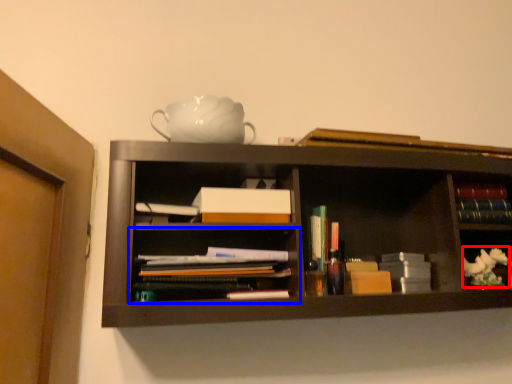
Question: Which of the following is the closest to the observer, flower (highlighted by a red box) or shelf (highlighted by a blue box)?

Choices:
 (A) flower
 (B) shelf

Answer: (B)